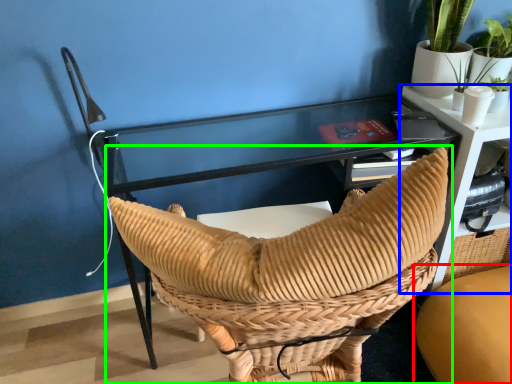
Question: Which object is the farthest from chair (highlighted by a red box)? Choose among these: table (highlighted by a blue box) or chair (highlighted by a green box).

Choices:
 (A) table
 (B) chair

Answer: (B)